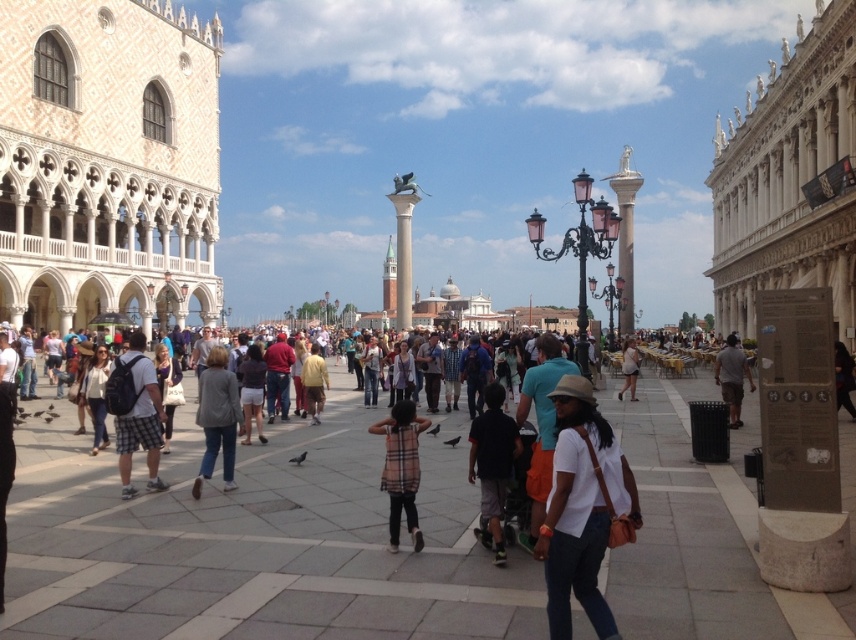
You are standing in the historic square and want to take a photo that includes both the point at coordinates point (230,467) and point (637,369). Given their positions, which point should you focus on first to ensure both are in sharp focus?

You should focus on point (230,467) first because it is closer to the camera than point (637,369), ensuring both will be in focus when using a proper aperture setting.